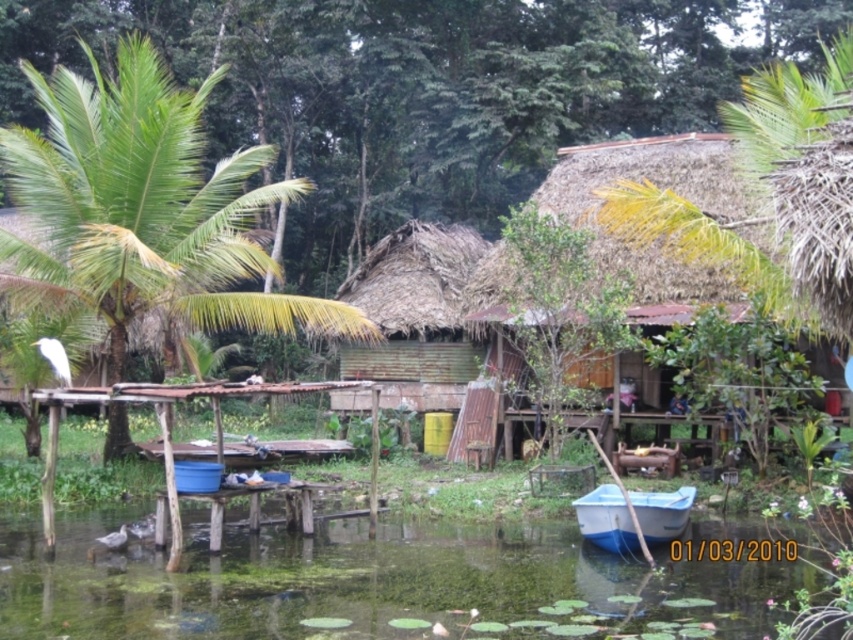
Question: Does green mossy water at lower center appear under green leafy palm tree at left?

Choices:
 (A) no
 (B) yes

Answer: (B)

Question: Is green corrugated metal hut at center closer to camera compared to white plastic boat at lower center?

Choices:
 (A) no
 (B) yes

Answer: (A)

Question: Which of the following is the farthest from the observer?

Choices:
 (A) green leafy palm tree at left
 (B) green corrugated metal hut at center

Answer: (B)

Question: Among these points, which one is nearest to the camera?

Choices:
 (A) (677, 502)
 (B) (305, 186)

Answer: (A)

Question: Which point is farther from the camera taking this photo?

Choices:
 (A) pyautogui.click(x=200, y=528)
 (B) pyautogui.click(x=737, y=186)
 (C) pyautogui.click(x=601, y=528)
 (D) pyautogui.click(x=457, y=364)

Answer: (D)

Question: Is green leafy palm tree at left below thatched straw hut at center?

Choices:
 (A) yes
 (B) no

Answer: (B)